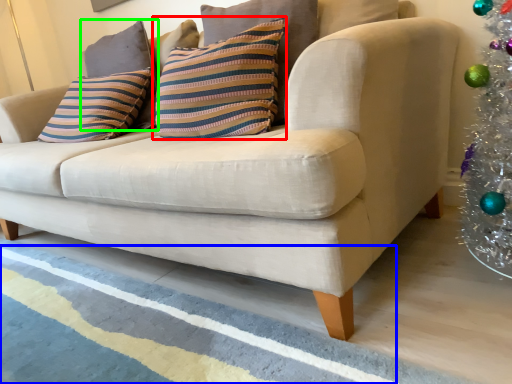
Question: Considering the real-world distances, which object is closest to pillow (highlighted by a red box)? stripe (highlighted by a blue box) or pillow (highlighted by a green box).

Choices:
 (A) stripe
 (B) pillow

Answer: (B)